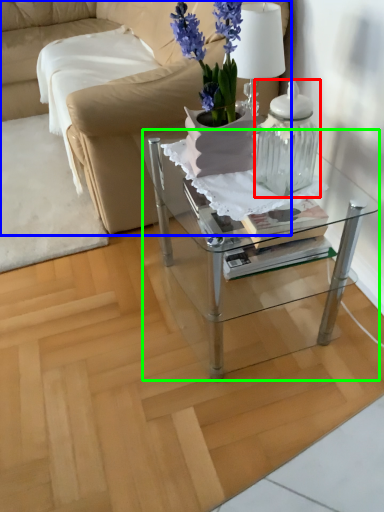
Question: Considering the real-world distances, which object is farthest from candle holder (highlighted by a red box)? studio couch (highlighted by a blue box) or table (highlighted by a green box)?

Choices:
 (A) studio couch
 (B) table

Answer: (A)